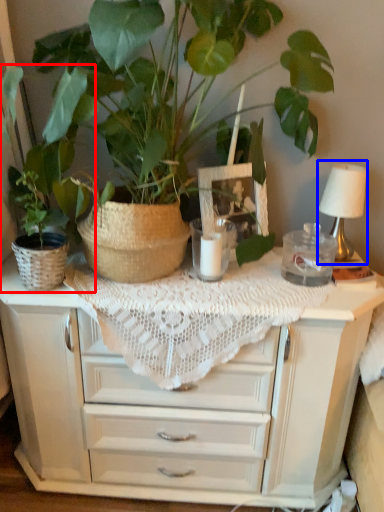
Question: Which object appears farthest to the camera in this image, houseplant (highlighted by a red box) or table lamp (highlighted by a blue box)?

Choices:
 (A) houseplant
 (B) table lamp

Answer: (B)